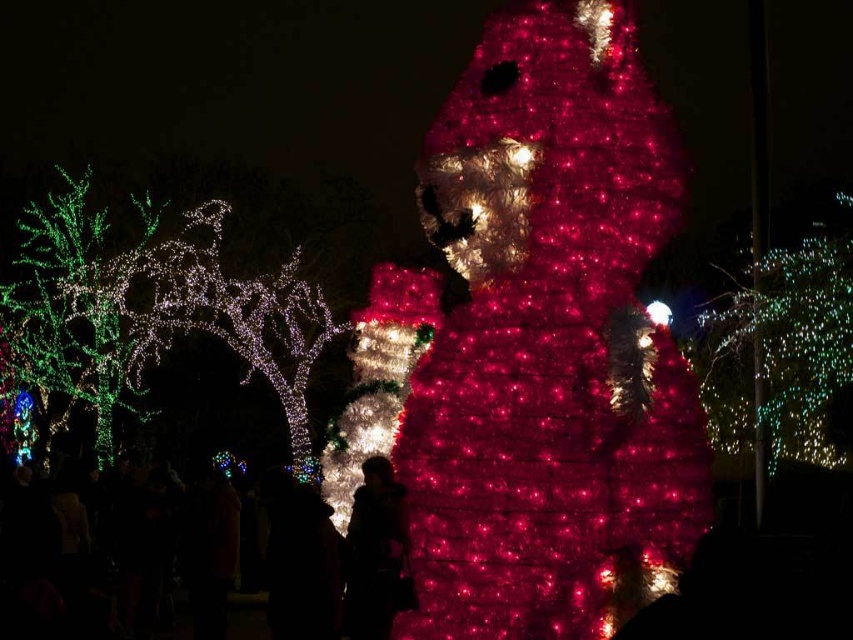
You are standing in the festive nighttime scene and want to know which object is taller between the illuminated plastic christmas tree at center and the silhouette fabric person at center. Can you tell me?

The illuminated plastic christmas tree at center is taller than the silhouette fabric person at center.